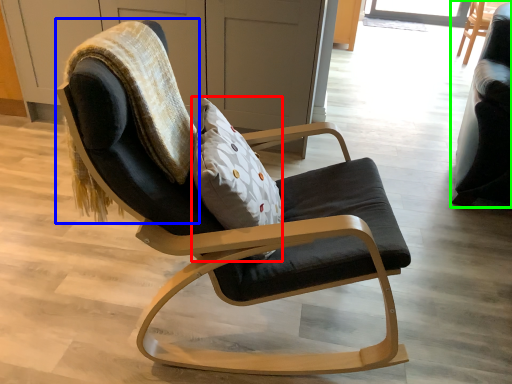
Question: Considering the real-world distances, which object is farthest from pillow (highlighted by a red box)? bean bag chair (highlighted by a blue box) or chair (highlighted by a green box)?

Choices:
 (A) bean bag chair
 (B) chair

Answer: (B)